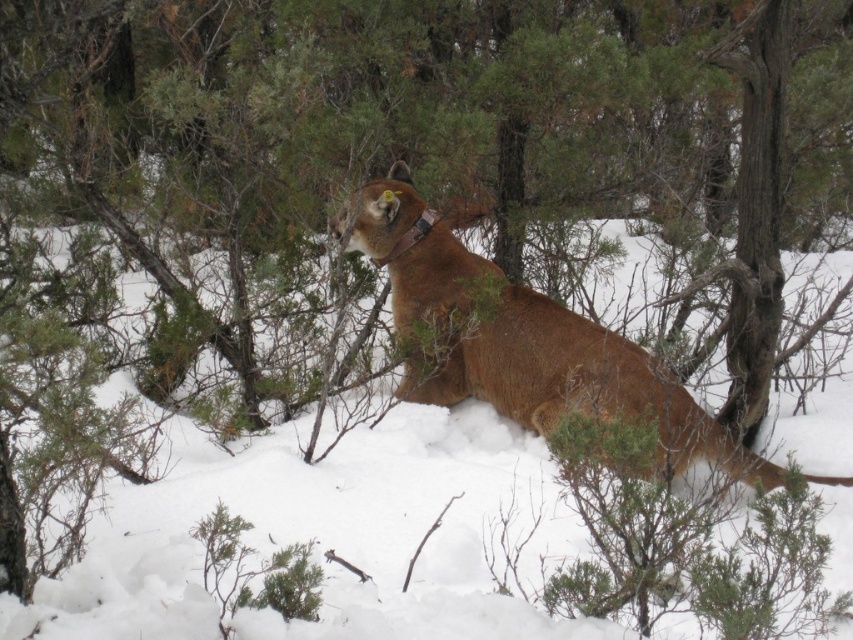
Does point (164, 241) lie behind point (511, 321)?

That is True.

Does green leafy tree at center appear under brown fur at center?

No, green leafy tree at center is not below brown fur at center.

Is point (35, 132) positioned in front of point (410, 276)?

That is False.

At what (x,y) coordinates should I click in order to perform the action: click on green leafy tree at center. Please return your answer as a coordinate pair (x, y). This screenshot has height=640, width=853. Looking at the image, I should click on (419, 136).